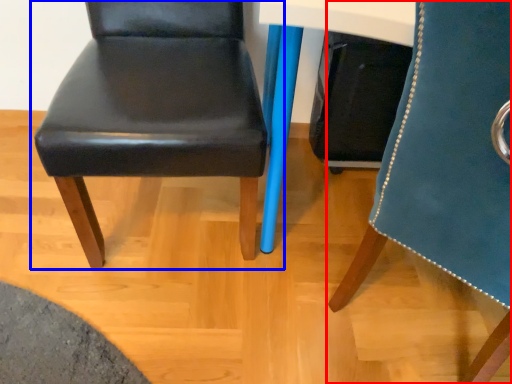
Question: Among these objects, which one is farthest to the camera, chair (highlighted by a red box) or chair (highlighted by a blue box)?

Choices:
 (A) chair
 (B) chair

Answer: (B)